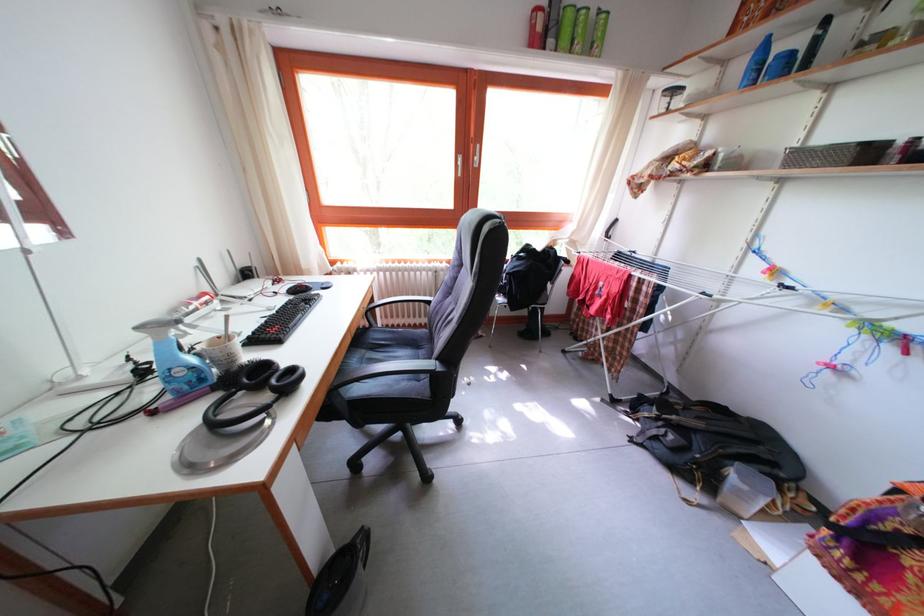
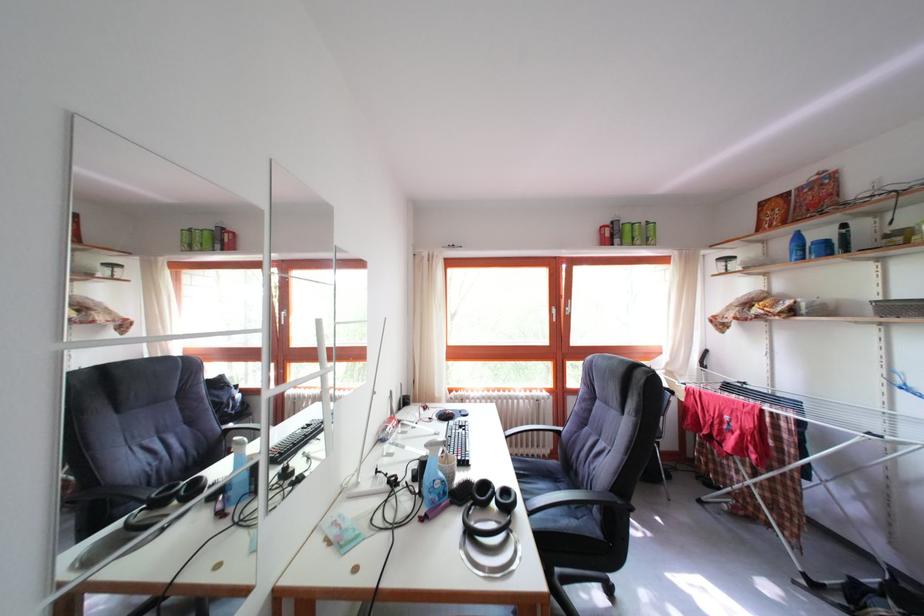
Question: Based on the continuous images, in which direction is the camera rotating? Reply with the corresponding letter.

Choices:
 (A) Left
 (B) Right
 (C) Up
 (D) Down

Answer: (C)